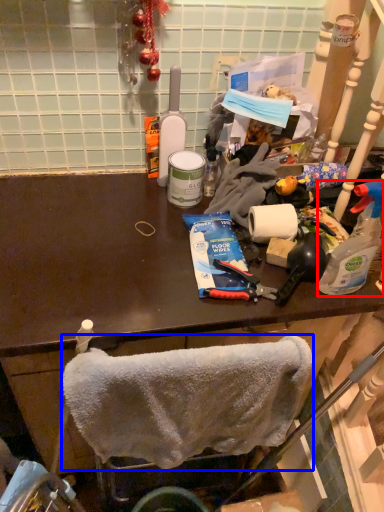
Question: Which object appears farthest to the camera in this image, bottle (highlighted by a red box) or towel/napkin (highlighted by a blue box)?

Choices:
 (A) bottle
 (B) towel/napkin

Answer: (A)